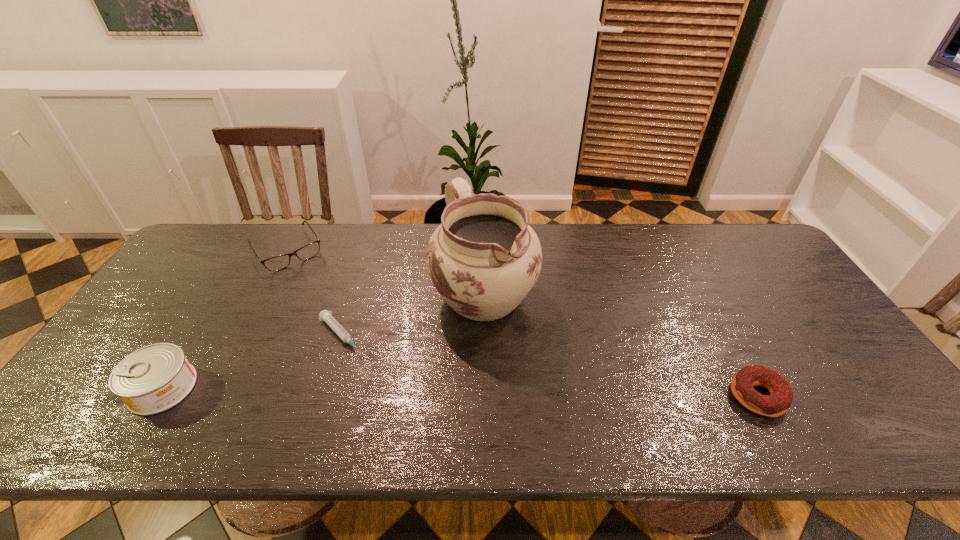
At what (x,y) coordinates should I click in order to perform the action: click on vacant spot on the desktop that is between the second tallest object and the rightmost object and is positioned at the needle end of the third object from left to right. Please return your answer as a coordinate pair (x, y). Looking at the image, I should click on 394,391.

Find the location of a particular element. The height and width of the screenshot is (540, 960). vacant spot on the desktop that is between the can and the rightmost object and is positioned on the lenses of the spectacles is located at coordinates (379, 390).

Image resolution: width=960 pixels, height=540 pixels. In order to click on vacant space on the desktop that is between the fourth shortest object and the doughnut and is positioned on the spout of the tallest object in this screenshot , I will do `click(533, 393)`.